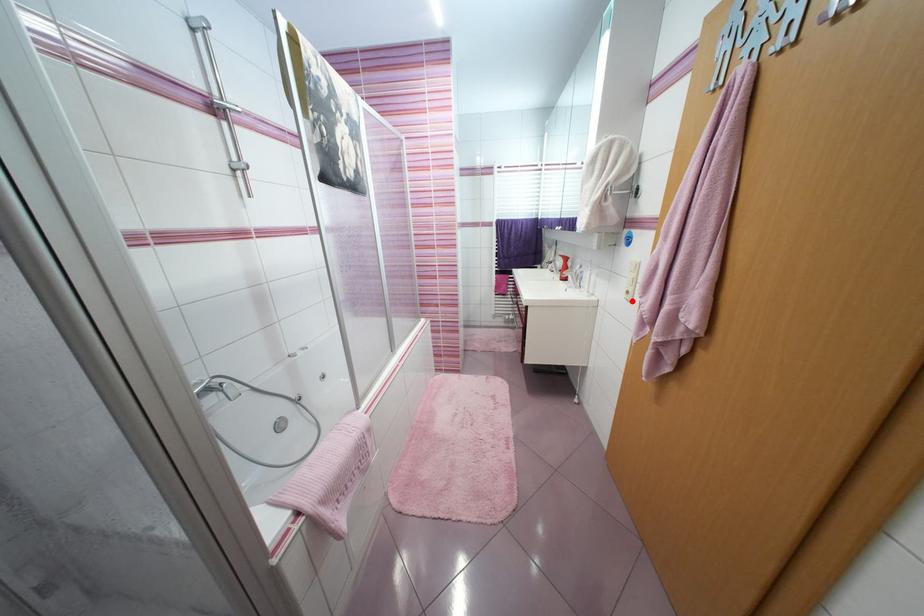
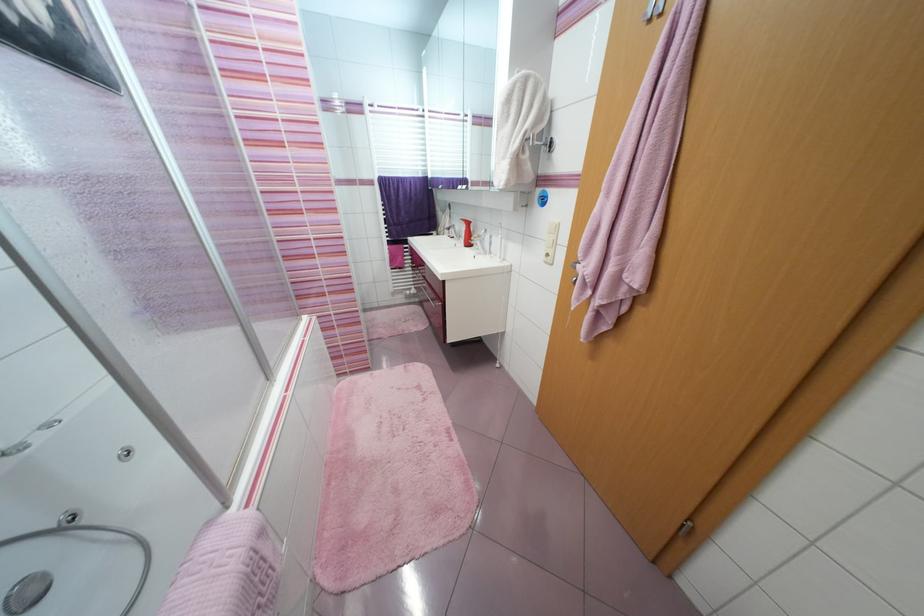
The point at the highlighted location is marked in the first image. Where is the corresponding point in the second image?

(551, 264)